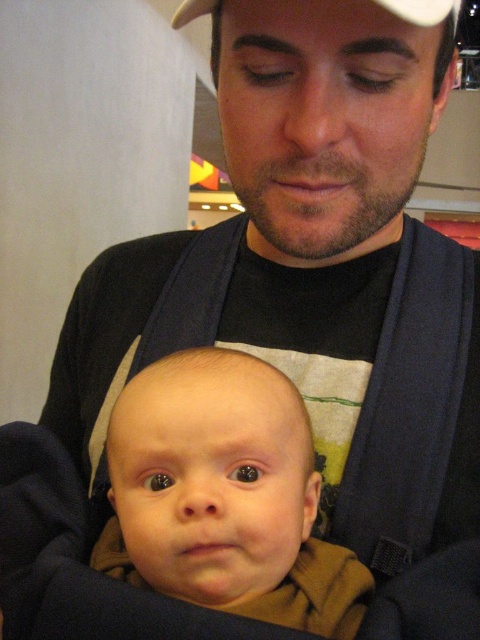
Question: Which object is the farthest from the brown soft fabric baby at center?

Choices:
 (A) white matte baseball cap at upper center
 (B) navy blue fabric strap at center

Answer: (A)

Question: Is navy blue fabric strap at center smaller than white matte baseball cap at upper center?

Choices:
 (A) yes
 (B) no

Answer: (A)

Question: Does navy blue fabric strap at center have a larger size compared to white matte baseball cap at upper center?

Choices:
 (A) no
 (B) yes

Answer: (A)

Question: Which point is closer to the camera?

Choices:
 (A) pyautogui.click(x=172, y=300)
 (B) pyautogui.click(x=216, y=406)
 (C) pyautogui.click(x=444, y=1)

Answer: (C)

Question: Which object is positioned farthest from the navy blue fabric strap at center?

Choices:
 (A) brown soft fabric baby at center
 (B) white matte baseball cap at upper center

Answer: (B)

Question: Is brown soft fabric baby at center further to camera compared to navy blue fabric strap at center?

Choices:
 (A) no
 (B) yes

Answer: (A)